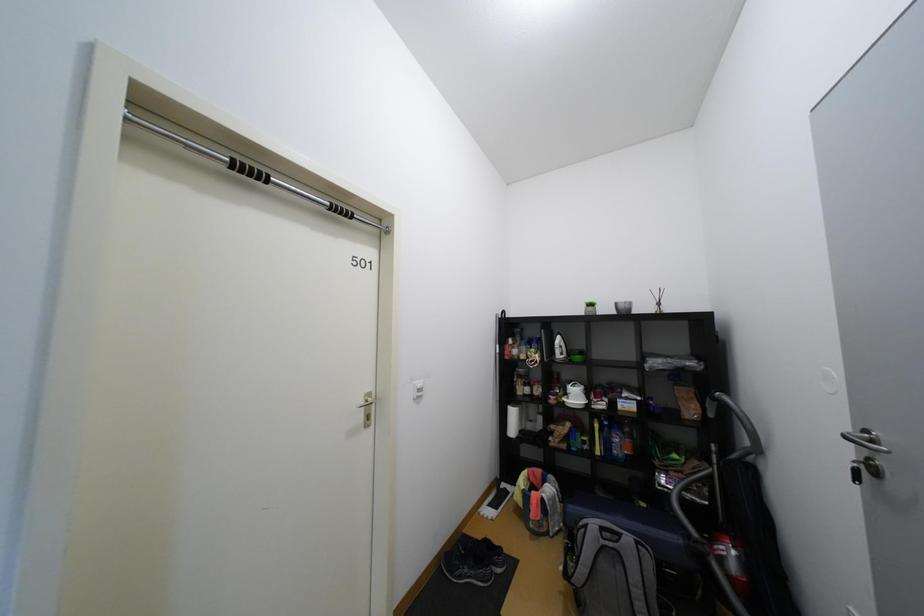
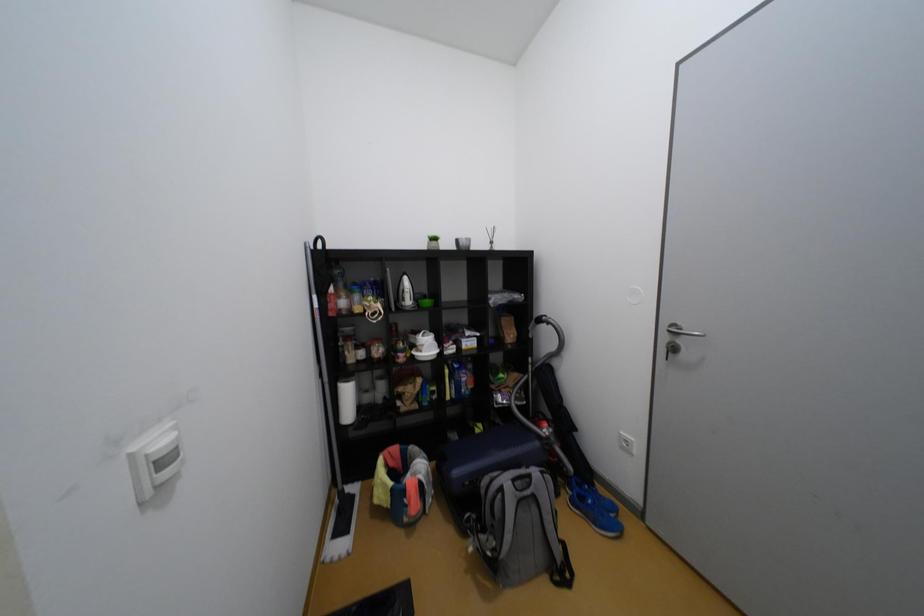
Question: The first image is from the beginning of the video and the second image is from the end. How did the camera likely rotate when shooting the video?

Choices:
 (A) Left
 (B) Right
 (C) Up
 (D) Down

Answer: (B)